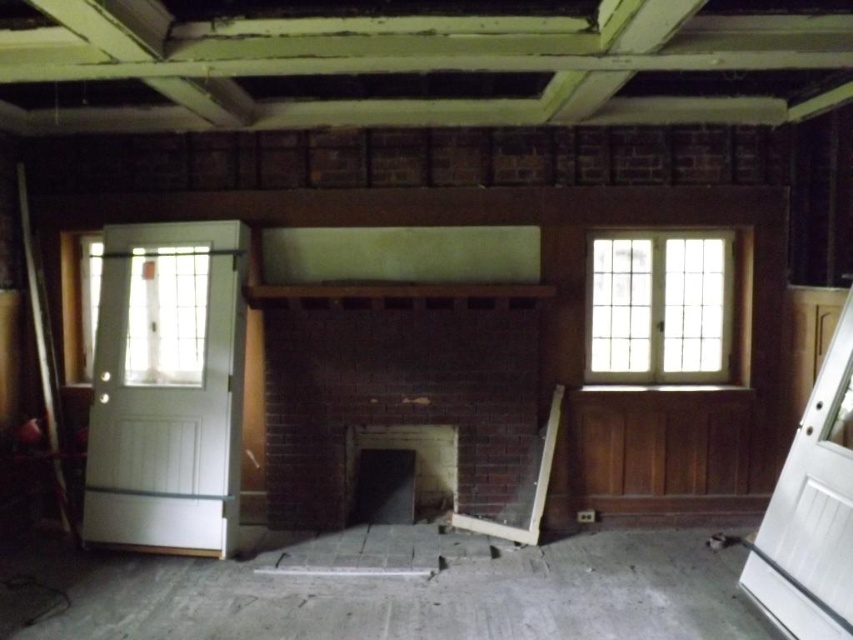
You are a painter who needs to reach a high spot on the brick fireplace at center. You see a metallic silver ladder at left. Can you use the ladder to reach the fireplace if the ladder is 1.8 meters long?

The brick fireplace at center and metallic silver ladder at left are 2.04 meters apart. Since the ladder is only 1.8 meters long, it is too short to span the distance between them. You cannot use the ladder to reach the fireplace.

From the picture: You are standing in the middle of the room and want to exit through one of the doors. Which door, the white wood door at left or the white wood door at right, is closer to you?

The white wood door at left is closer to you because it is further to the viewer than the white wood door at right, meaning it is positioned nearer in the space.